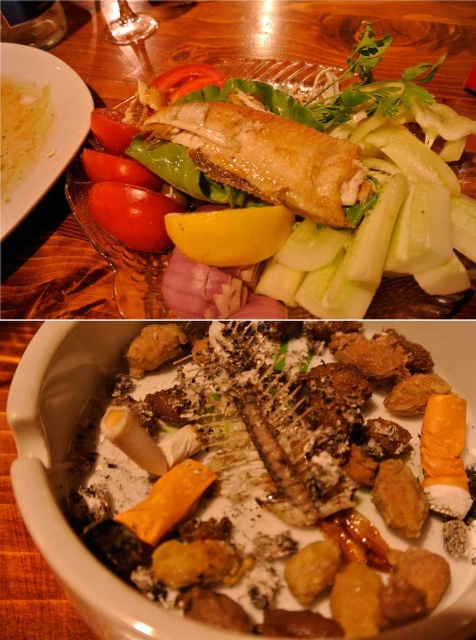
Question: Based on their relative distances, which object is nearer to the crumbly golden bread at center?

Choices:
 (A) matte brown plate at upper left
 (B) golden crispy fish at center

Answer: (B)

Question: Which object is the closest to the crumbly golden bread at center?

Choices:
 (A) matte brown plate at upper left
 (B) golden crispy fish at center

Answer: (B)

Question: Can you confirm if crumbly golden bread at center is positioned to the right of golden crispy fish at center?

Choices:
 (A) no
 (B) yes

Answer: (B)

Question: Can you confirm if golden crispy fish at center is positioned above matte brown plate at upper left?

Choices:
 (A) no
 (B) yes

Answer: (B)

Question: Does golden crispy fish at center appear over matte brown plate at upper left?

Choices:
 (A) no
 (B) yes

Answer: (B)

Question: Which point is farther to the camera?

Choices:
 (A) (267, 417)
 (B) (17, 120)
 (C) (177, 228)
 (D) (424, 312)

Answer: (B)